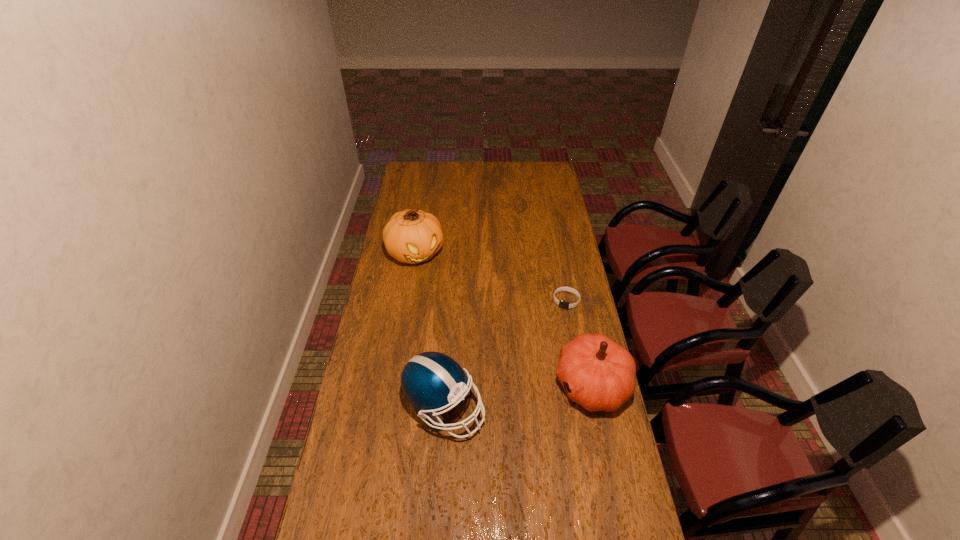
The width and height of the screenshot is (960, 540). Find the location of `football helmet`. football helmet is located at coordinates (432, 381).

At what (x,y) coordinates should I click in order to perform the action: click on the right pumpkin. Please return your answer as a coordinate pair (x, y). The height and width of the screenshot is (540, 960). Looking at the image, I should click on (599, 374).

Where is `wristband`? Image resolution: width=960 pixels, height=540 pixels. wristband is located at coordinates (562, 304).

Find the location of a particular element. Image resolution: width=960 pixels, height=540 pixels. the shortest object is located at coordinates (562, 304).

The height and width of the screenshot is (540, 960). Identify the location of the farthest object. [x=412, y=236].

Identify the location of the farther pumpkin. The height and width of the screenshot is (540, 960). (412, 236).

The width and height of the screenshot is (960, 540). Identify the location of vacant region located at the front of the football helmet with the faceguard. (578, 407).

At what (x,y) coordinates should I click in order to perform the action: click on vacant space situated on the front-facing side of the right pumpkin. Please return your answer as a coordinate pair (x, y). Looking at the image, I should click on (529, 384).

This screenshot has width=960, height=540. In order to click on free space located on the front-facing side of the right pumpkin in this screenshot , I will do `click(534, 384)`.

At what (x,y) coordinates should I click in order to perform the action: click on vacant region located on the front-facing side of the right pumpkin. Please return your answer as a coordinate pair (x, y). This screenshot has height=540, width=960. Looking at the image, I should click on (517, 384).